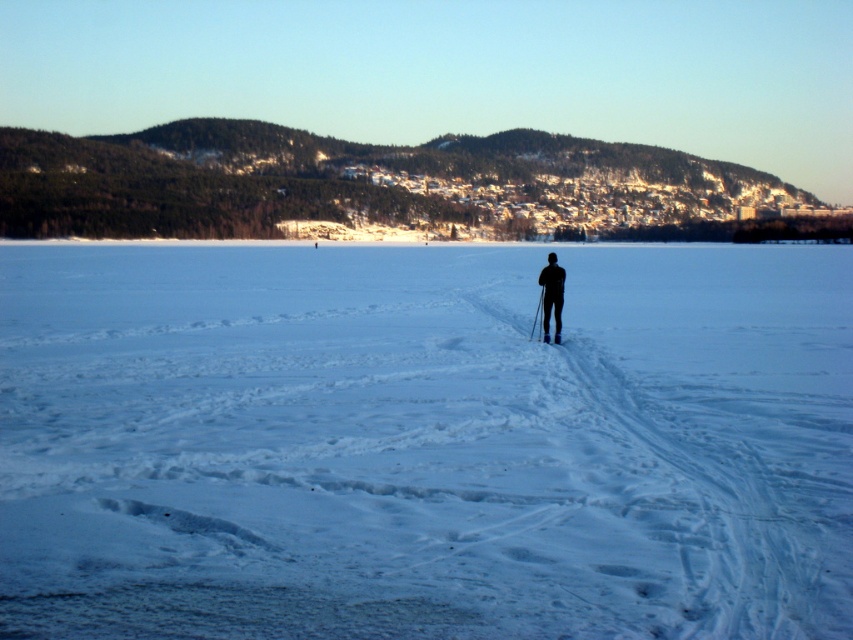
Is white powder snow at center smaller than black matte skier at center?

No.

This screenshot has height=640, width=853. What do you see at coordinates (424, 442) in the screenshot?
I see `white powder snow at center` at bounding box center [424, 442].

Is point (514, 563) closer to camera compared to point (547, 260)?

Yes, it is in front of point (547, 260).

At what (x,y) coordinates should I click in order to perform the action: click on white powder snow at center. Please return your answer as a coordinate pair (x, y). Looking at the image, I should click on (424, 442).